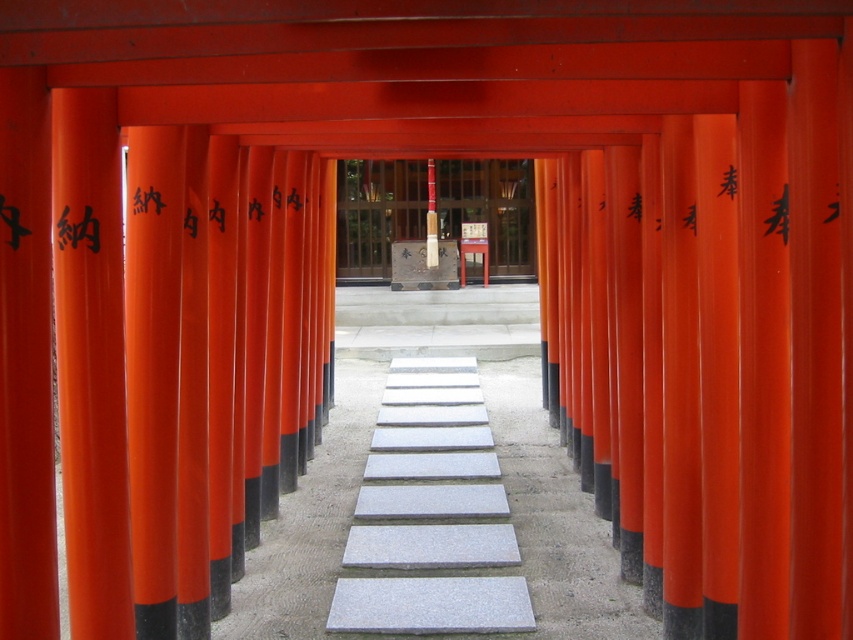
Question: Considering the real-world distances, which object is closest to the gray stone stairs at center?

Choices:
 (A) smooth wooden post at center
 (B) smooth wooden pole at center
 (C) gray stone slabs at center

Answer: (C)

Question: Observing the image, what is the correct spatial positioning of gray stone slabs at center in reference to black painted writing at center?

Choices:
 (A) right
 (B) left

Answer: (A)

Question: Is gray stone stairs at center below smooth wooden post at center?

Choices:
 (A) yes
 (B) no

Answer: (A)

Question: Which object is the farthest from the black painted writing at center?

Choices:
 (A) smooth wooden post at center
 (B) smooth wooden pole at center

Answer: (A)

Question: Which point is closer to the camera taking this photo?

Choices:
 (A) (430, 225)
 (B) (329, 604)
 (C) (96, 218)
 (D) (473, 186)

Answer: (C)

Question: Where is black painted writing at center located in relation to smooth wooden pole at center in the image?

Choices:
 (A) right
 (B) left

Answer: (B)